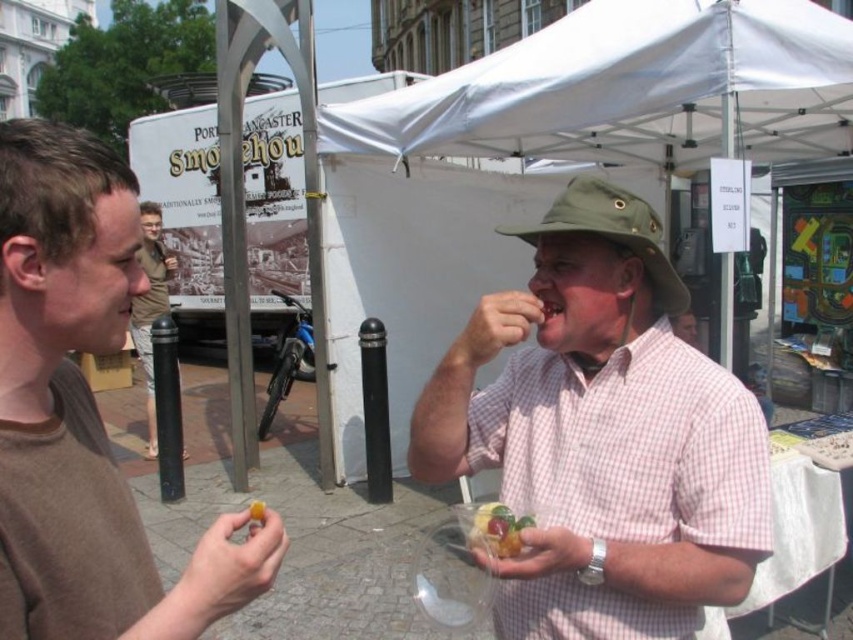
Question: Which is nearer to the white fabric canopy at upper center?

Choices:
 (A) brown matte shirt at left
 (B) white fabric tent at center
 (C) yellow translucent cube at center
 (D) pink checkered shirt at center

Answer: (B)

Question: Is white fabric tent at center further to the viewer compared to yellow translucent cube at center?

Choices:
 (A) yes
 (B) no

Answer: (A)

Question: Does pink checkered shirt at center have a larger size compared to light brown fabric shirt at left?

Choices:
 (A) yes
 (B) no

Answer: (B)

Question: Is white fabric tent at center smaller than translucent plastic cup at center?

Choices:
 (A) yes
 (B) no

Answer: (B)

Question: Which of the following is the closest to the observer?

Choices:
 (A) [19, 589]
 (B) [570, 353]

Answer: (A)

Question: Among these objects, which one is nearest to the camera?

Choices:
 (A) translucent plastic cup at center
 (B) white fabric canopy at upper center
 (C) yellow translucent cube at center

Answer: (C)